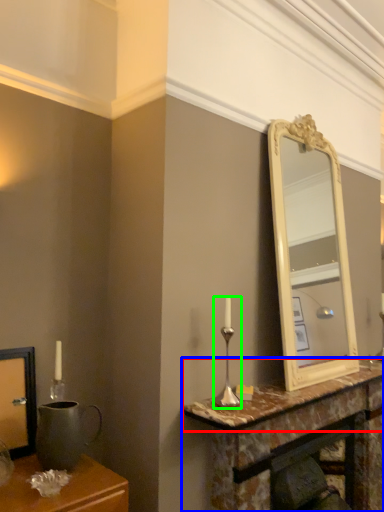
Question: Based on their relative distances, which object is nearer to counter top (highlighted by a red box)? Choose from table (highlighted by a blue box) and candle holder (highlighted by a green box).

Choices:
 (A) table
 (B) candle holder

Answer: (A)